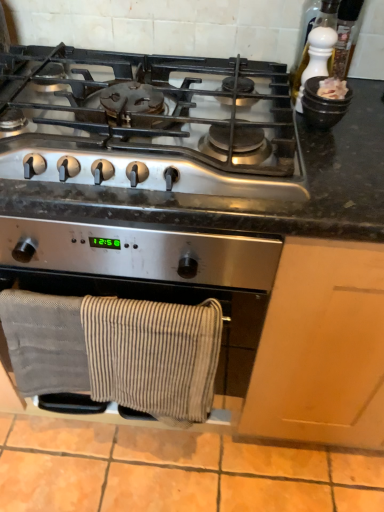
This screenshot has width=384, height=512. Describe the element at coordinates (140, 253) in the screenshot. I see `gray cotton towels at lower center` at that location.

Image resolution: width=384 pixels, height=512 pixels. What do you see at coordinates (317, 57) in the screenshot? I see `white ceramic pepper grinder at upper right` at bounding box center [317, 57].

You are a GUI agent. You are given a task and a screenshot of the screen. Output one action in this format:
    pyautogui.click(x=<x>, y=<y>)
    Task: Click on the white ceramic pepper grinder at upper right
    This screenshot has width=384, height=512.
    Given the screenshot: What is the action you would take?
    pyautogui.click(x=317, y=57)

I want to click on gray cotton towels at lower center, so click(x=140, y=253).

Is white ceramic pepper grinder at upper right oriented towards gray cotton towels at lower center?

No, white ceramic pepper grinder at upper right is not facing towards gray cotton towels at lower center.

The width and height of the screenshot is (384, 512). I want to click on kitchen appliance on the left of white ceramic pepper grinder at upper right, so click(140, 253).

Between white ceramic pepper grinder at upper right and gray cotton towels at lower center, which one appears on the right side from the viewer's perspective?

white ceramic pepper grinder at upper right is more to the right.

From the picture: Is gray cotton towels at lower center positioned in front of white ceramic pepper grinder at upper right?

Yes.

Is gray cotton towels at lower center at the right side of white ceramic pepper grinder at upper right?

Incorrect, gray cotton towels at lower center is not on the right side of white ceramic pepper grinder at upper right.

Find the location of `kitchen appliance that appears in front of the white ceramic pepper grinder at upper right`. kitchen appliance that appears in front of the white ceramic pepper grinder at upper right is located at coordinates coord(140,253).

From the image's perspective, is white ceramic pepper grinder at upper right above or below satin silver gas stove at upper center?

From the image's perspective, white ceramic pepper grinder at upper right appears above satin silver gas stove at upper center.

Which object is thinner, white ceramic pepper grinder at upper right or satin silver gas stove at upper center?

white ceramic pepper grinder at upper right is thinner.

From a real-world perspective, which is physically below, white ceramic pepper grinder at upper right or satin silver gas stove at upper center?

satin silver gas stove at upper center.

Considering the positions of objects satin silver gas stove at upper center and white ceramic pepper grinder at upper right in the image provided, who is in front, satin silver gas stove at upper center or white ceramic pepper grinder at upper right?

satin silver gas stove at upper center is closer to the camera.

Does satin silver gas stove at upper center have a larger size compared to white ceramic pepper grinder at upper right?

Yes, satin silver gas stove at upper center is bigger than white ceramic pepper grinder at upper right.

Is satin silver gas stove at upper center inside or outside of white ceramic pepper grinder at upper right?

satin silver gas stove at upper center is located beyond the bounds of white ceramic pepper grinder at upper right.

Is satin silver gas stove at upper center turned away from white ceramic pepper grinder at upper right?

No, satin silver gas stove at upper center is not facing away from white ceramic pepper grinder at upper right.

How many degrees apart are the facing directions of gray cotton towels at lower center and satin silver gas stove at upper center?

0.063 degrees separate the facing orientations of gray cotton towels at lower center and satin silver gas stove at upper center.

Which object is positioned more to the right, gray cotton towels at lower center or satin silver gas stove at upper center?

satin silver gas stove at upper center is more to the right.

Is gray cotton towels at lower center taller or shorter than satin silver gas stove at upper center?

In the image, gray cotton towels at lower center appears to be taller than satin silver gas stove at upper center.

Is satin silver gas stove at upper center surrounded by gray cotton towels at lower center?

No, gray cotton towels at lower center does not contain satin silver gas stove at upper center.

Considering the sizes of objects satin silver gas stove at upper center and gray cotton towels at lower center in the image provided, who is taller, satin silver gas stove at upper center or gray cotton towels at lower center?

With more height is gray cotton towels at lower center.

Would you consider satin silver gas stove at upper center to be distant from gray cotton towels at lower center?

They are positioned close to each other.

How many degrees apart are the facing directions of satin silver gas stove at upper center and gray cotton towels at lower center?

There is a 0.063-degree angle between the facing directions of satin silver gas stove at upper center and gray cotton towels at lower center.

Which object is further away from the camera taking this photo, satin silver gas stove at upper center or gray cotton towels at lower center?

gray cotton towels at lower center is behind.

Image resolution: width=384 pixels, height=512 pixels. Identify the location of kitchen appliance on the left of the white ceramic pepper grinder at upper right. tap(140, 253).

I want to click on appliance behind the gray cotton towels at lower center, so point(317,57).

From the image, which object appears to be farther from satin silver gas stove at upper center, white ceramic pepper grinder at upper right or gray cotton towels at lower center?

Among the two, white ceramic pepper grinder at upper right is located further to satin silver gas stove at upper center.

Based on their spatial positions, is white ceramic pepper grinder at upper right or satin silver gas stove at upper center further from gray cotton towels at lower center?

white ceramic pepper grinder at upper right.

From the image, which object appears to be nearer to white ceramic pepper grinder at upper right, gray cotton towels at lower center or satin silver gas stove at upper center?

satin silver gas stove at upper center.

Looking at the image, which one is located closer to white ceramic pepper grinder at upper right, satin silver gas stove at upper center or gray cotton towels at lower center?

The object closer to white ceramic pepper grinder at upper right is satin silver gas stove at upper center.

Considering their positions, is satin silver gas stove at upper center positioned closer to gray cotton towels at lower center than white ceramic pepper grinder at upper right?

satin silver gas stove at upper center is closer to gray cotton towels at lower center.

Based on their spatial positions, is gray cotton towels at lower center or white ceramic pepper grinder at upper right closer to satin silver gas stove at upper center?

The object closer to satin silver gas stove at upper center is gray cotton towels at lower center.

Where is `gas stove between white ceramic pepper grinder at upper right and gray cotton towels at lower center from top to bottom`? This screenshot has height=512, width=384. gas stove between white ceramic pepper grinder at upper right and gray cotton towels at lower center from top to bottom is located at coordinates (150, 122).